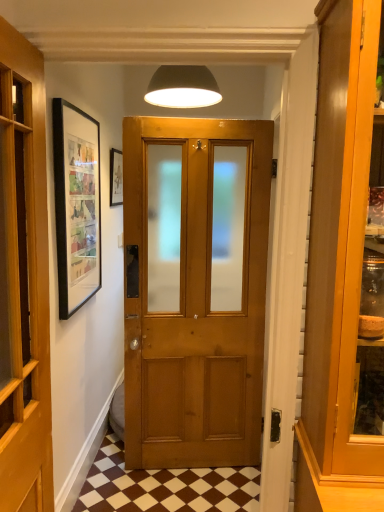
Question: Can you confirm if wooden door at center is shorter than matte black picture frame at upper left?

Choices:
 (A) yes
 (B) no

Answer: (B)

Question: Does wooden door at center have a greater height compared to matte black picture frame at upper left?

Choices:
 (A) no
 (B) yes

Answer: (B)

Question: From the image's perspective, would you say wooden door at center is shown under matte black picture frame at upper left?

Choices:
 (A) yes
 (B) no

Answer: (A)

Question: From a real-world perspective, is wooden door at center under matte black picture frame at upper left?

Choices:
 (A) no
 (B) yes

Answer: (B)

Question: Would you say wooden door at center contains matte black picture frame at upper left?

Choices:
 (A) yes
 (B) no

Answer: (B)

Question: Is the surface of wooden door at center in direct contact with matte black picture frame at upper left?

Choices:
 (A) no
 (B) yes

Answer: (A)

Question: From a real-world perspective, is matte black lampshade at upper center beneath brown checkered tile at lower center?

Choices:
 (A) no
 (B) yes

Answer: (A)

Question: Does matte black lampshade at upper center come in front of brown checkered tile at lower center?

Choices:
 (A) yes
 (B) no

Answer: (B)

Question: Does matte black lampshade at upper center contain brown checkered tile at lower center?

Choices:
 (A) no
 (B) yes

Answer: (A)

Question: Considering the relative sizes of matte black lampshade at upper center and brown checkered tile at lower center in the image provided, is matte black lampshade at upper center shorter than brown checkered tile at lower center?

Choices:
 (A) no
 (B) yes

Answer: (A)

Question: Is matte black lampshade at upper center at the left side of brown checkered tile at lower center?

Choices:
 (A) no
 (B) yes

Answer: (A)

Question: Can you confirm if matte black lampshade at upper center is thinner than brown checkered tile at lower center?

Choices:
 (A) yes
 (B) no

Answer: (A)

Question: Does brown checkered tile at lower center have a lesser width compared to wooden door at center?

Choices:
 (A) no
 (B) yes

Answer: (A)